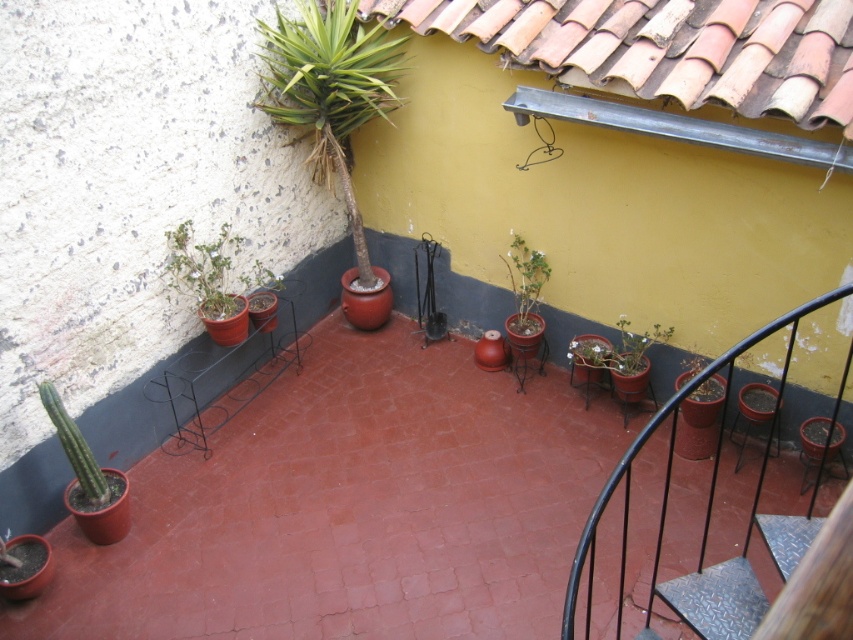
Who is lower down, green matte plant at left or green matte plant at lower right?

green matte plant at lower right

Between green matte plant at left and green matte plant at lower right, which one is positioned higher?

green matte plant at left is higher up.

Is point (213, 253) more distant than point (631, 358)?

Yes, it is.

What are the coordinates of `green matte plant at left` in the screenshot? It's located at (202, 269).

Looking at this image, who is more distant from viewer, [84,442] or [520,296]?

Positioned behind is point [520,296].

From the picture: Who is shorter, green matte cactus at lower left or green matte plant at center-right?

Standing shorter between the two is green matte plant at center-right.

Does point (100, 506) come farther from viewer compared to point (543, 259)?

No, it is not.

Identify the location of green matte cactus at lower left. Image resolution: width=853 pixels, height=640 pixels. (74, 449).

Which is above, green matte plant at left or green matte plant at center-right?

Positioned higher is green matte plant at center-right.

Between green matte plant at left and green matte plant at center-right, which one is positioned lower?

Positioned lower is green matte plant at left.

Who is more forward, (178,253) or (537,285)?

Point (178,253) is more forward.

Where is `green matte plant at left`? The height and width of the screenshot is (640, 853). green matte plant at left is located at coordinates (202, 269).